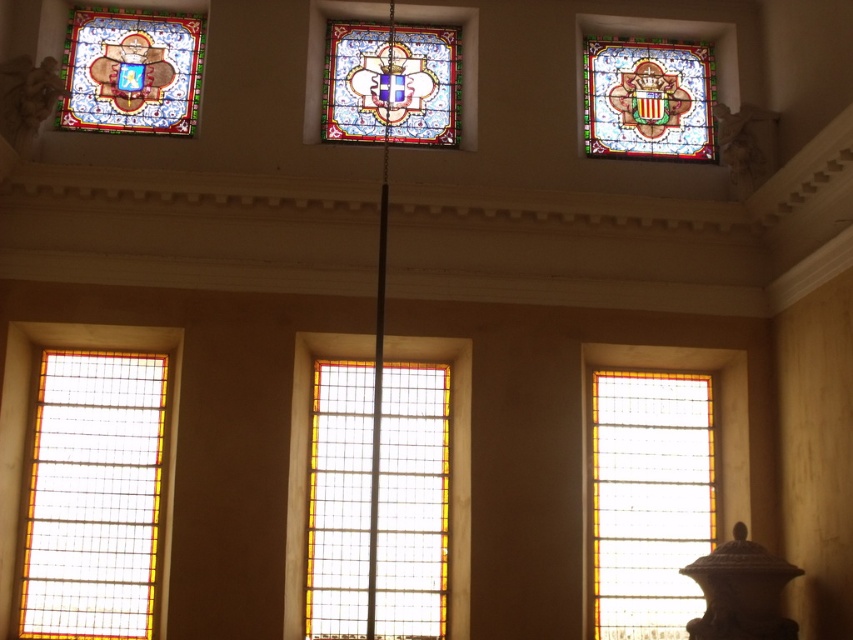
You are an architect designing a new building and want to ensure that the clear glass window at lower right and the stained glass at upper left are spaced appropriately. Given that the minimum required distance between any two windows in this design is 30 meters, is the current spacing between these two windows compliant with the requirement?

The distance between the clear glass window at lower right and the stained glass at upper left is 32.68 meters, which exceeds the minimum required distance of 30 meters. Therefore, the current spacing is compliant with the requirement.

You are standing in the room and want to look outside through the clear glass window at lower left. Based on its position, where should you look to find it?

You should look at point (x=93, y=497) to find the clear glass window at lower left.

You are an architect designing a new building and want to place a new light fixture in the center of the room. The room has a clear glass window at lower right. Where should you place the light fixture to ensure it is equidistant from all walls?

The light fixture should be placed at the center of the room, which is equidistant from all walls, but the clear glass window at lower right is located at point (648,500). This coordinate can help determine the room dimensions to ensure proper placement.